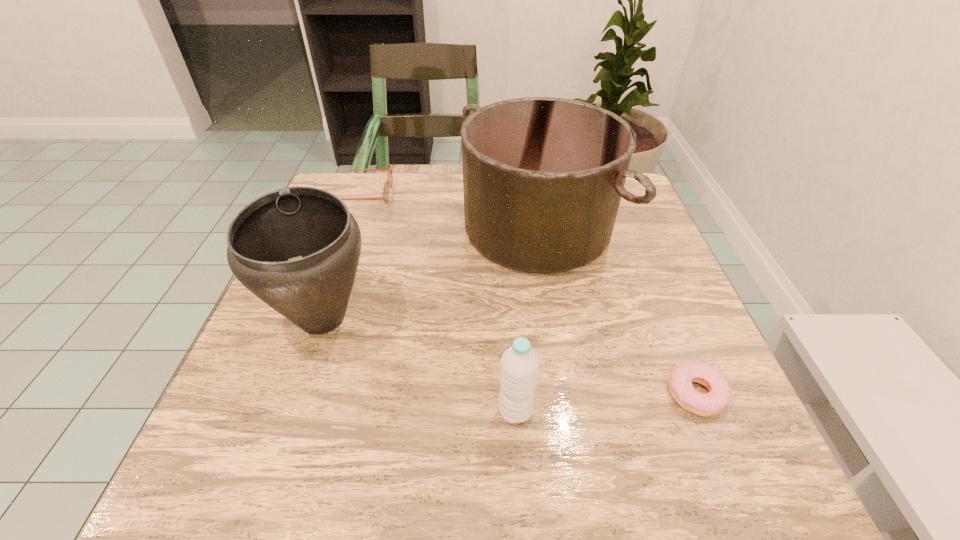
At what (x,y) coordinates should I click in order to perform the action: click on pan present at the far edge. Please return your answer as a coordinate pair (x, y). Looking at the image, I should click on (543, 177).

Image resolution: width=960 pixels, height=540 pixels. Identify the location of sunglasses that is positioned at the far edge. (385, 196).

You are a GUI agent. You are given a task and a screenshot of the screen. Output one action in this format:
    pyautogui.click(x=<x>, y=<y>)
    Task: Click on the urn that is at the left edge
    This screenshot has height=540, width=960.
    Given the screenshot: What is the action you would take?
    pyautogui.click(x=297, y=248)

The height and width of the screenshot is (540, 960). Find the location of `sunglasses at the left edge`. sunglasses at the left edge is located at coordinates (385, 196).

Where is `pan located at the right edge`? pan located at the right edge is located at coordinates (543, 177).

At what (x,y) coordinates should I click in order to perform the action: click on doughnut located in the right edge section of the desktop. Please return your answer as a coordinate pair (x, y). The width and height of the screenshot is (960, 540). Looking at the image, I should click on (680, 381).

Where is `object located at the far left corner`? This screenshot has height=540, width=960. object located at the far left corner is located at coordinates click(385, 196).

At what (x,y) coordinates should I click in order to perform the action: click on object present at the far right corner. Please return your answer as a coordinate pair (x, y). The image size is (960, 540). Looking at the image, I should click on (543, 177).

The image size is (960, 540). I want to click on vacant space at the far edge of the desktop, so click(424, 201).

What are the coordinates of `vacant region at the left edge of the desktop` in the screenshot? It's located at (316, 339).